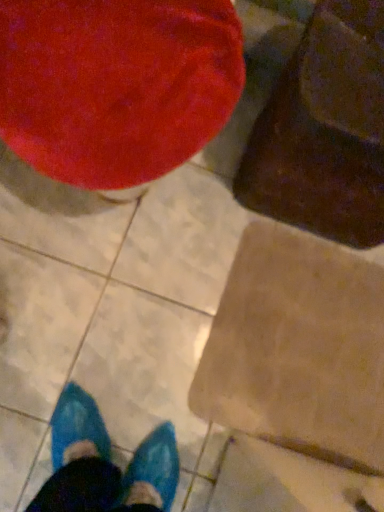
What are the coordinates of `free point above brown cardboard at lower right (from a real-world perspective)` in the screenshot? It's located at (307, 334).